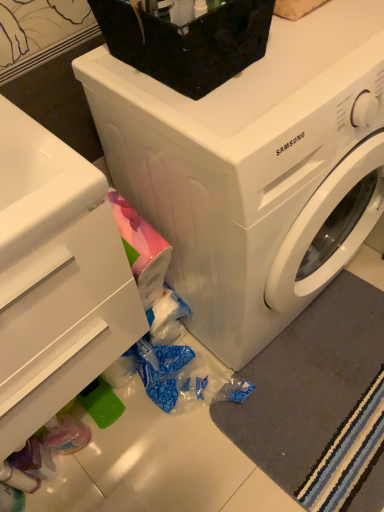
I want to click on vacant region above gray soft rug at lower right (from a real-world perspective), so click(x=331, y=382).